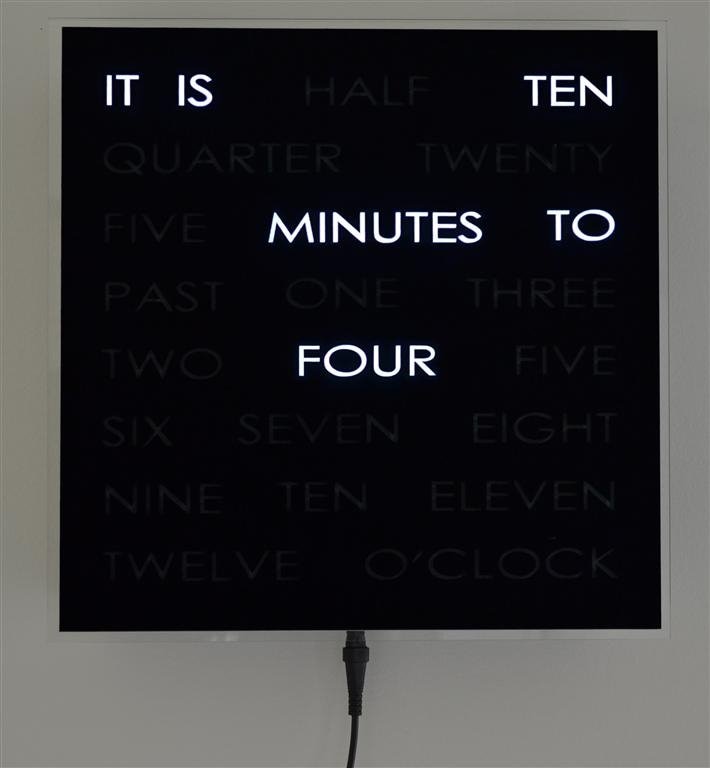
Find the location of a particular element. cord is located at coordinates (349, 657).